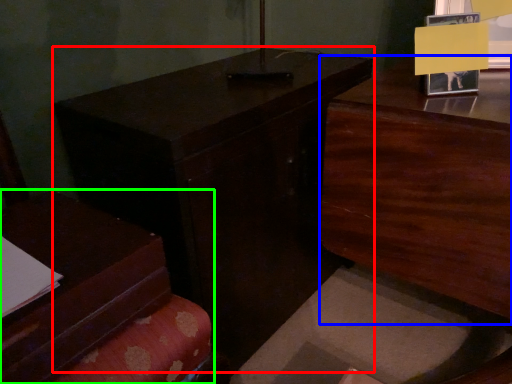
Question: Based on their relative distances, which object is farther from table (highlighted by a red box)? Choose from dresser (highlighted by a blue box) and furniture (highlighted by a green box).

Choices:
 (A) dresser
 (B) furniture

Answer: (A)